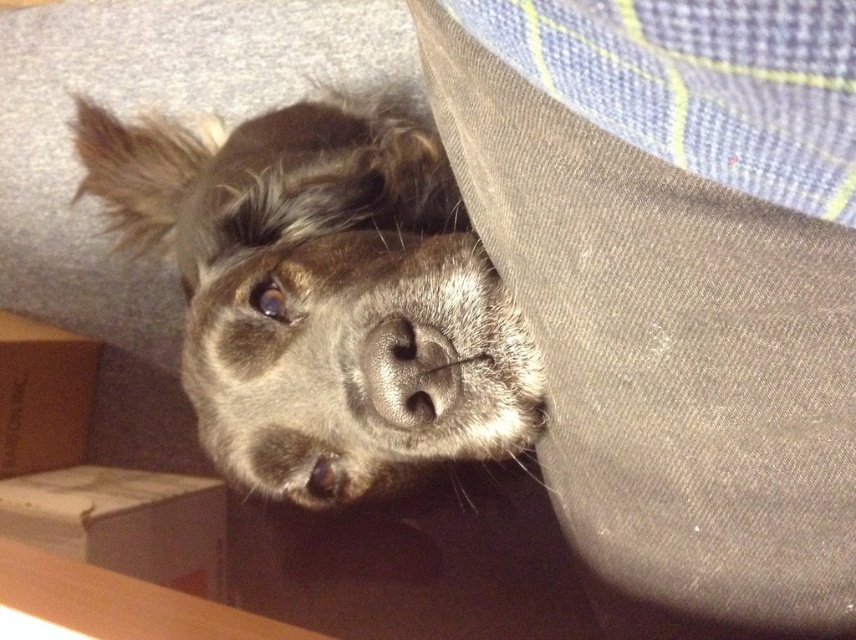
Question: Is fuzzy brown dog at center positioned behind sleek gray nose at center?

Choices:
 (A) yes
 (B) no

Answer: (A)

Question: Which point is closer to the camera?

Choices:
 (A) (441, 340)
 (B) (343, 280)

Answer: (A)

Question: In this image, where is fuzzy brown dog at center located relative to sleek gray nose at center?

Choices:
 (A) above
 (B) below

Answer: (A)

Question: Observing the image, what is the correct spatial positioning of fuzzy brown dog at center in reference to sleek gray nose at center?

Choices:
 (A) above
 (B) below

Answer: (A)